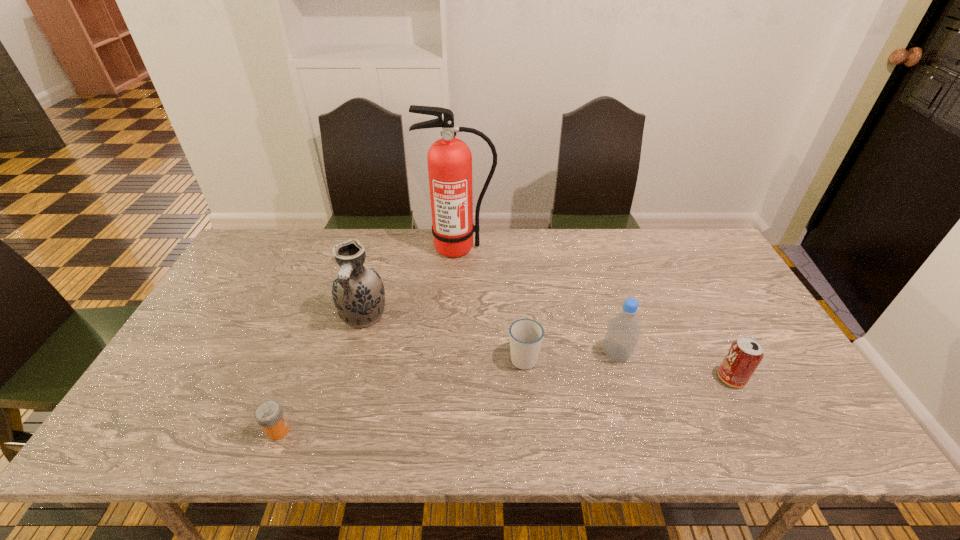
The width and height of the screenshot is (960, 540). In order to click on vacant space that satisfies the following two spatial constraints: 1. with the handle on the side of the vase; 2. on the left side of the soda can in this screenshot , I will do `click(347, 378)`.

Locate an element on the screen. The image size is (960, 540). vacant region that satisfies the following two spatial constraints: 1. with a handle on the side of the fourth shortest object; 2. on the left side of the third object from right to left is located at coordinates (523, 354).